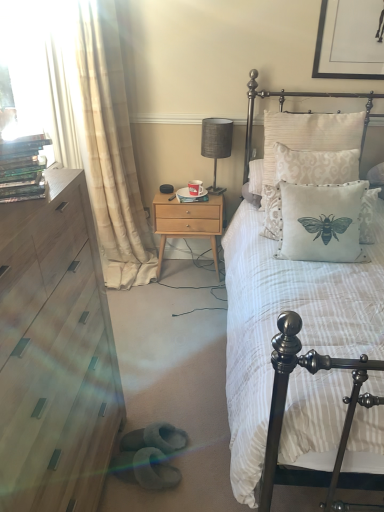
Question: From a real-world perspective, is silk-patterned pillow at upper right positioned over creamy beige fabric pillow at upper right, which is the first pillow from top to bottom, based on gravity?

Choices:
 (A) yes
 (B) no

Answer: (B)

Question: Is creamy beige fabric pillow at upper right, which is counted as the 2th pillow, starting from the bottom, surrounded by silk-patterned pillow at upper right?

Choices:
 (A) yes
 (B) no

Answer: (B)

Question: From the image's perspective, is silk-patterned pillow at upper right on top of creamy beige fabric pillow at upper right, which is the first pillow from top to bottom?

Choices:
 (A) yes
 (B) no

Answer: (A)

Question: Is silk-patterned pillow at upper right beside creamy beige fabric pillow at upper right, which is counted as the 2th pillow, starting from the bottom?

Choices:
 (A) yes
 (B) no

Answer: (B)

Question: Considering the relative sizes of silk-patterned pillow at upper right and creamy beige fabric pillow at upper right, which is the first pillow from top to bottom, in the image provided, is silk-patterned pillow at upper right thinner than creamy beige fabric pillow at upper right, which is the first pillow from top to bottom,?

Choices:
 (A) no
 (B) yes

Answer: (A)

Question: From the image's perspective, is transparent plastic dvds at left located above or below white fabric pillow with bee design at center, the 2th pillow from the top?

Choices:
 (A) above
 (B) below

Answer: (A)

Question: Based on their sizes in the image, would you say transparent plastic dvds at left is bigger or smaller than white fabric pillow with bee design at center, the first pillow ordered from the bottom?

Choices:
 (A) small
 (B) big

Answer: (B)

Question: In the image, is transparent plastic dvds at left positioned in front of or behind white fabric pillow with bee design at center, the first pillow ordered from the bottom?

Choices:
 (A) front
 (B) behind

Answer: (B)

Question: Do you think transparent plastic dvds at left is within white fabric pillow with bee design at center, the first pillow ordered from the bottom, or outside of it?

Choices:
 (A) outside
 (B) inside

Answer: (A)

Question: Would you say matte gray fabric table lamp at center is to the left or to the right of transparent plastic dvds at left in the picture?

Choices:
 (A) right
 (B) left

Answer: (A)

Question: From a real-world perspective, is matte gray fabric table lamp at center above or below transparent plastic dvds at left?

Choices:
 (A) above
 (B) below

Answer: (B)

Question: Considering the positions of matte gray fabric table lamp at center and transparent plastic dvds at left in the image, is matte gray fabric table lamp at center bigger or smaller than transparent plastic dvds at left?

Choices:
 (A) big
 (B) small

Answer: (B)

Question: Relative to transparent plastic dvds at left, is matte gray fabric table lamp at center in front or behind?

Choices:
 (A) behind
 (B) front

Answer: (A)

Question: In terms of width, does creamy beige fabric pillow at upper right, which is the first pillow from top to bottom, look wider or thinner when compared to silk-patterned pillow at upper right?

Choices:
 (A) thin
 (B) wide

Answer: (A)

Question: Is creamy beige fabric pillow at upper right, which is counted as the 2th pillow, starting from the bottom, in front of or behind silk-patterned pillow at upper right in the image?

Choices:
 (A) behind
 (B) front

Answer: (B)